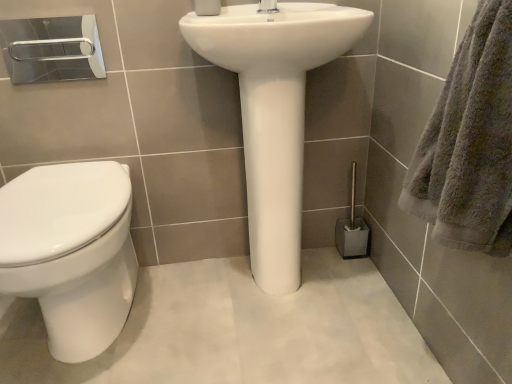
Find the location of a particular element. Image resolution: width=512 pixels, height=384 pixels. empty space that is in between white glossy toilet at left and white glossy sink at center is located at coordinates (204, 312).